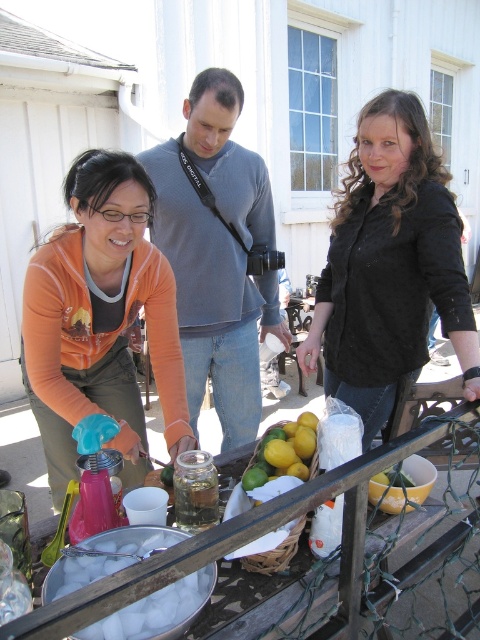
You are a guest at a summer barbecue and need to identify clothing items based on their height. Which clothing item is shorter between the orange fabric apron at lower left and the gray cotton sweater at center?

The orange fabric apron at lower left is shorter than the gray cotton sweater at center because it is not as tall as the sweater.

You are organizing a clothing donation drive and need to determine which items can fit into a standard donation bin. The bin has a width limit of 40 cm. You have two items to assess from the image description provided. Which of the two items, the black textured shirt at center or the gray cotton sweater at center, is more likely to fit within the bin based on their widths?

The black textured shirt at center has a smaller width than the gray cotton sweater at center. Since the donation bin has a 40 cm width limit, the black textured shirt at center is more likely to fit within the bin compared to the gray cotton sweater at center.

You are a photographer setting up a shoot in this outdoor scene. You need to place a small prop between the orange fabric apron at lower left and the gray cotton sweater at center. Based on their positions, which side should you place the prop closer to?

The orange fabric apron at lower left is positioned on the left side of gray cotton sweater at center, so you should place the prop closer to the orange fabric apron at lower left since it is on the left side.